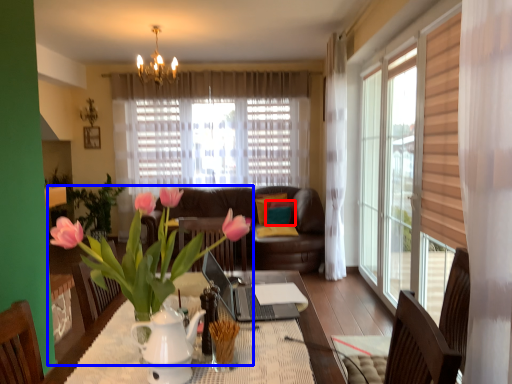
Question: Which of the following is the closest to the observer, pillow (highlighted by a red box) or houseplant (highlighted by a blue box)?

Choices:
 (A) pillow
 (B) houseplant

Answer: (B)